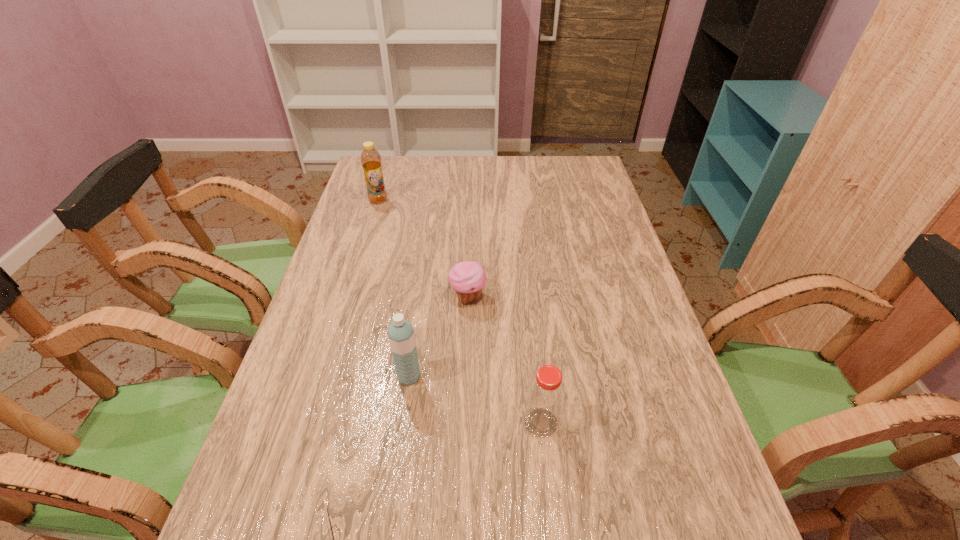
At what (x,y) coordinates should I click in order to perform the action: click on free space between the second object from right to left and the right bottle. Please return your answer as a coordinate pair (x, y). This screenshot has width=960, height=540. Looking at the image, I should click on (505, 360).

Locate an element on the screen. The width and height of the screenshot is (960, 540). free area in between the fourth farthest object and the second farthest object is located at coordinates (505, 360).

The width and height of the screenshot is (960, 540). What are the coordinates of `free point between the left bottle and the second shortest object` in the screenshot? It's located at (423, 248).

Locate an element on the screen. This screenshot has height=540, width=960. object identified as the fourth closest to the nearest object is located at coordinates (371, 162).

Identify which object is the nearest to the third nearest object. Please provide its 2D coordinates. Your answer should be formatted as a tuple, i.e. [(x, y)], where the tuple contains the x and y coordinates of a point satisfying the conditions above.

[(468, 278)]